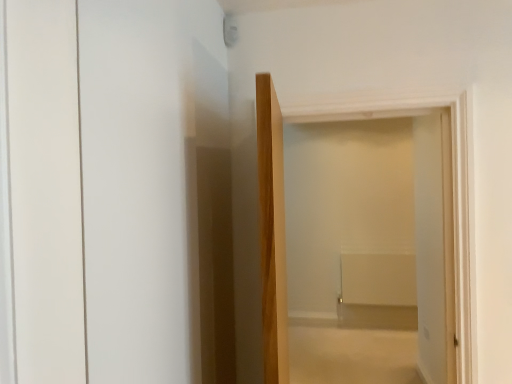
Question: Is white glossy door at left not within white matte door at center?

Choices:
 (A) yes
 (B) no

Answer: (A)

Question: Does white glossy door at left appear on the left side of white matte door at center?

Choices:
 (A) yes
 (B) no

Answer: (A)

Question: Is white glossy door at left further to the viewer compared to white matte door at center?

Choices:
 (A) no
 (B) yes

Answer: (A)

Question: From the image's perspective, is white glossy door at left on white matte door at center?

Choices:
 (A) no
 (B) yes

Answer: (B)

Question: Is white glossy door at left in front of white matte door at center?

Choices:
 (A) no
 (B) yes

Answer: (B)

Question: Can you confirm if white glossy door at left is smaller than white matte door at center?

Choices:
 (A) no
 (B) yes

Answer: (B)

Question: From a real-world perspective, is white matte door at center located beneath white glossy door at left?

Choices:
 (A) no
 (B) yes

Answer: (B)

Question: Is white matte door at center at the right side of white glossy door at left?

Choices:
 (A) no
 (B) yes

Answer: (B)

Question: Is white matte door at center beside white glossy door at left?

Choices:
 (A) no
 (B) yes

Answer: (A)

Question: Does white matte door at center have a smaller size compared to white glossy door at left?

Choices:
 (A) no
 (B) yes

Answer: (A)

Question: Is white matte door at center thinner than white glossy door at left?

Choices:
 (A) yes
 (B) no

Answer: (B)

Question: Could you tell me if white matte door at center is turned towards white glossy door at left?

Choices:
 (A) yes
 (B) no

Answer: (B)

Question: Is white matte door at center in front of or behind white glossy door at left in the image?

Choices:
 (A) behind
 (B) front

Answer: (A)